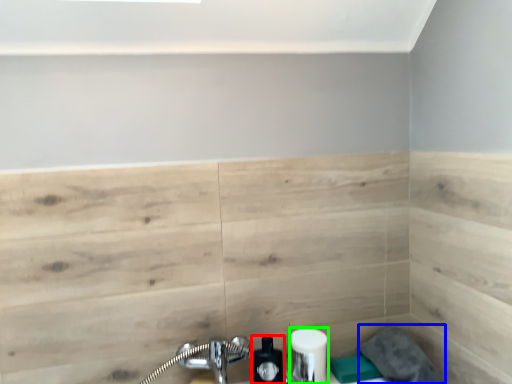
Question: Which is farther away from soap dispenser (highlighted by a red box)? gray (highlighted by a blue box) or toiletry (highlighted by a green box)?

Choices:
 (A) gray
 (B) toiletry

Answer: (A)